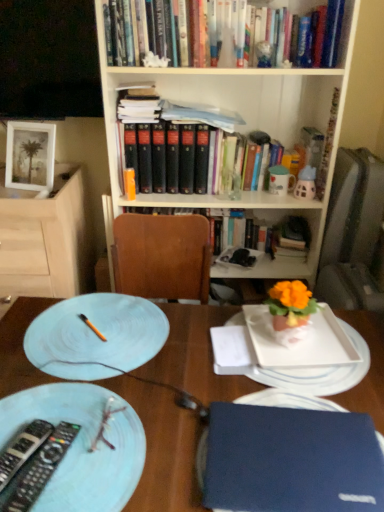
Locate an element on the screen. vacant area that lies in front of light blue ceramic plate at center-left, which appears as the second plate when viewed from the front is located at coordinates (105, 424).